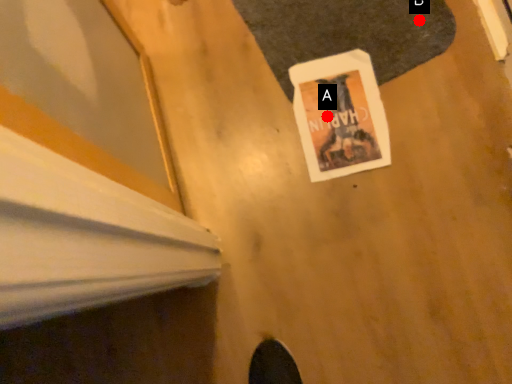
Question: Two points are circled on the image, labeled by A and B beside each circle. Which of the following is the closest to the observer?

Choices:
 (A) A is closer
 (B) B is closer

Answer: (A)